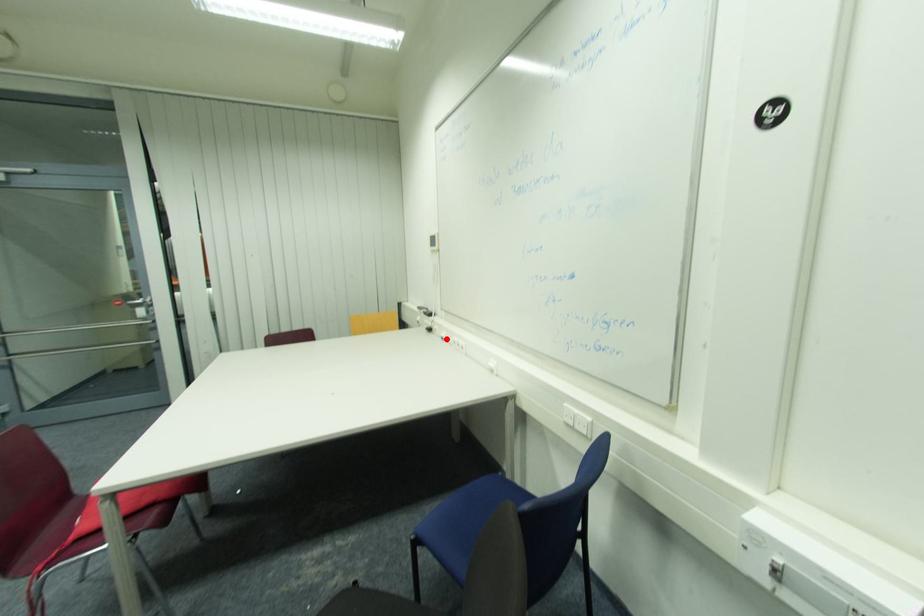
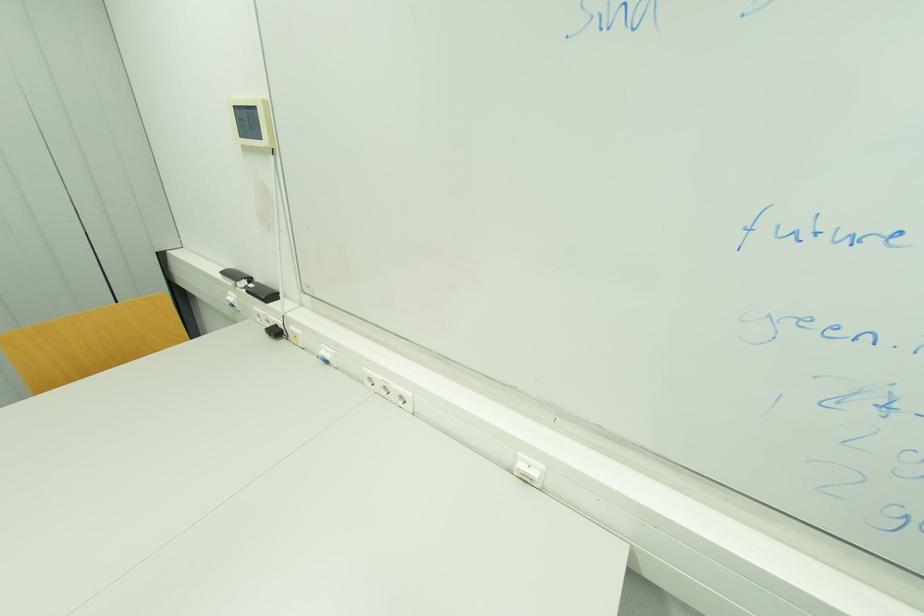
Where in the second image is the point corresponding to the highlighted location from the first image?

(330, 362)